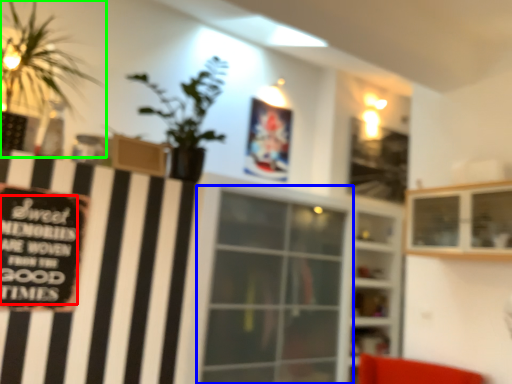
Question: Estimate the real-world distances between objects in this image. Which object is closer to writing (highlighted by a red box), window (highlighted by a blue box) or houseplant (highlighted by a green box)?

Choices:
 (A) window
 (B) houseplant

Answer: (B)